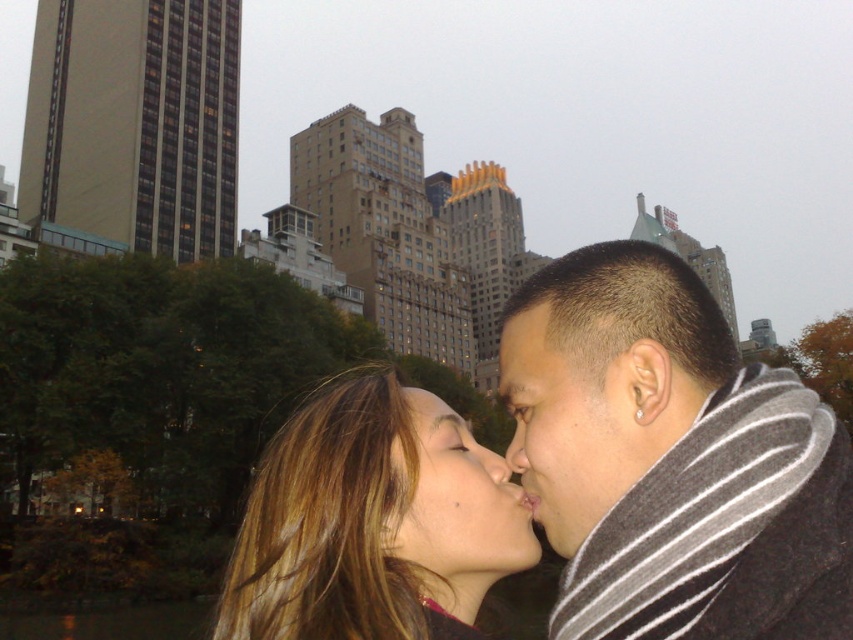
Is point (563, 525) closer to camera compared to point (531, 308)?

That is True.

Measure the distance between point (550,513) and camera.

The distance of point (550,513) from camera is 23.44 meters.

What do you see at coordinates (570, 426) in the screenshot? I see `matte gray scarf at right` at bounding box center [570, 426].

This screenshot has width=853, height=640. In order to click on matte gray scarf at right in this screenshot , I will do `click(570, 426)`.

Is point (631, 554) less distant than point (502, 342)?

That is True.

This screenshot has height=640, width=853. Describe the element at coordinates (677, 464) in the screenshot. I see `dark gray striped scarf at right` at that location.

Which is in front, point (552, 296) or point (532, 369)?

Point (532, 369) is more forward.

Locate an element on the screen. dark gray striped scarf at right is located at coordinates (677, 464).

Between point (653, 419) and point (520, 454), which one is positioned in front?

Point (653, 419)

Does point (573, 388) lie behind point (517, 452)?

That is False.

The width and height of the screenshot is (853, 640). Identify the location of dark gray striped scarf at right. (677, 464).

Find the location of `dark gray striped scarf at right`. dark gray striped scarf at right is located at coordinates coord(677,464).